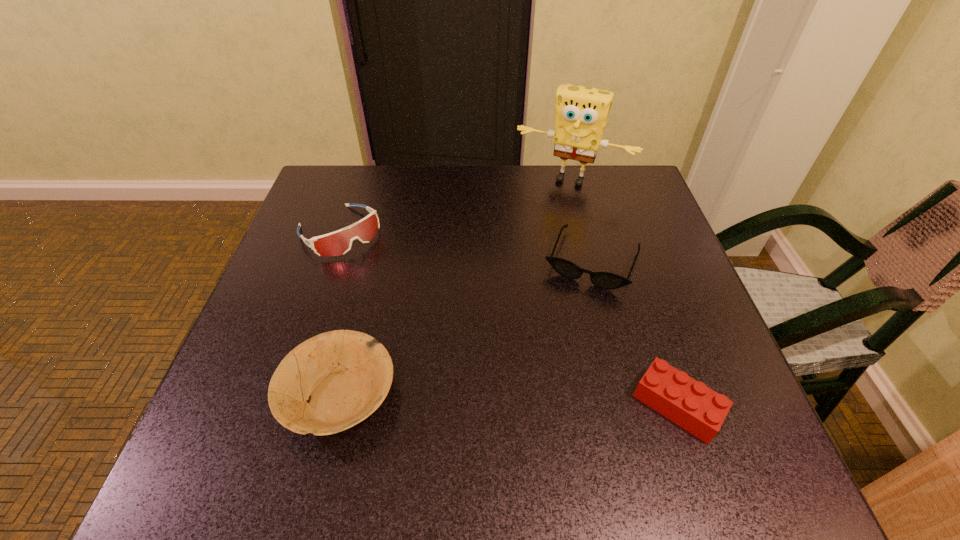
This screenshot has width=960, height=540. I want to click on vacant space on the desktop that is between the bowl and the Lego and is positioned on the front-facing side of the sunglasses, so click(538, 401).

I want to click on vacant spot on the desktop that is between the bowl and the Lego and is positioned on the front-facing side of the fourth shortest object, so click(x=494, y=400).

You are a GUI agent. You are given a task and a screenshot of the screen. Output one action in this format:
    pyautogui.click(x=<x>, y=<y>)
    Task: Click on the free space on the desktop that is between the bowl and the Lego and is positioned on the face of the tallest object
    
    Given the screenshot: What is the action you would take?
    pyautogui.click(x=472, y=399)